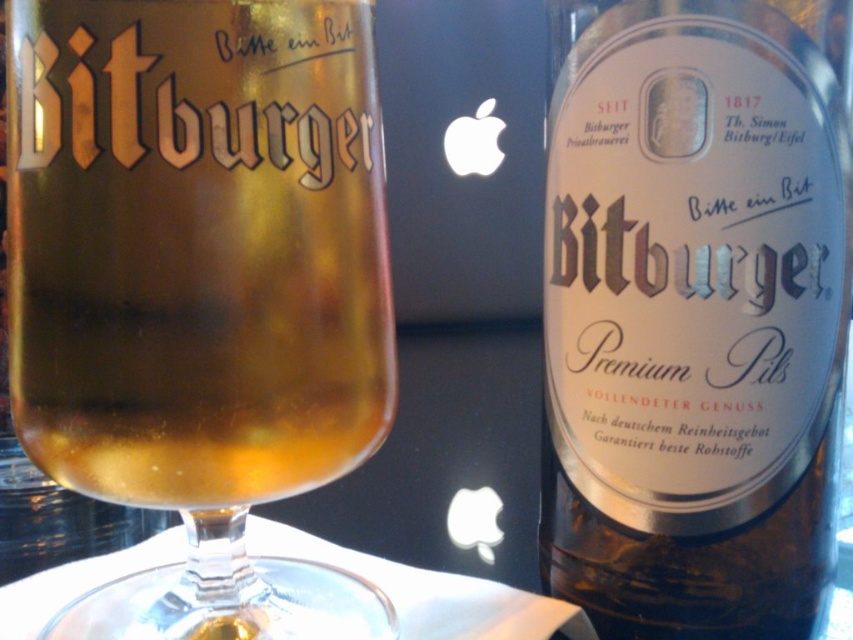
Question: Does translucent glass beer glass at center appear over translucent glass bottle at center?

Choices:
 (A) no
 (B) yes

Answer: (A)

Question: Which point is closer to the camera?

Choices:
 (A) translucent glass bottle at center
 (B) translucent glass beer glass at center

Answer: (B)

Question: Can you confirm if translucent glass beer glass at center is positioned to the left of translucent glass bottle at center?

Choices:
 (A) no
 (B) yes

Answer: (B)

Question: Which object is farther from the camera taking this photo?

Choices:
 (A) translucent glass beer glass at center
 (B) translucent glass bottle at center

Answer: (B)

Question: Does translucent glass beer glass at center lie in front of translucent glass bottle at center?

Choices:
 (A) no
 (B) yes

Answer: (B)